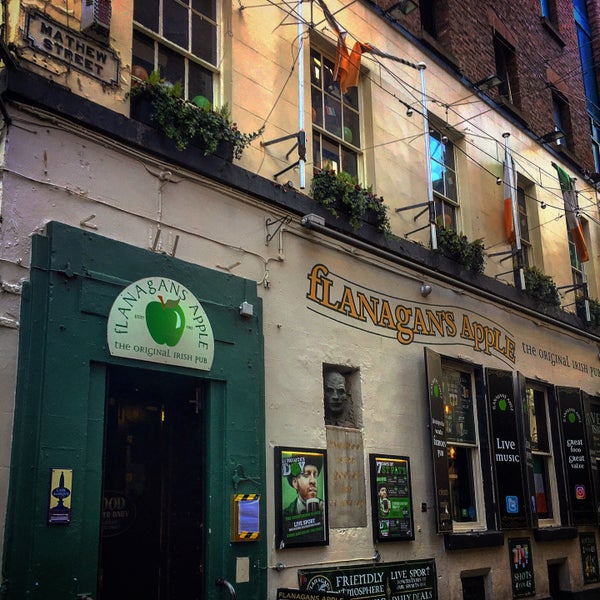
At what (x,y) coordinates should I click in order to perform the action: click on entrance way. Please return your answer as a coordinate pair (x, y). Looking at the image, I should click on (163, 441).